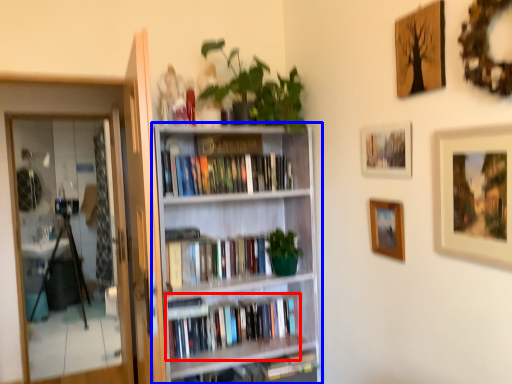
Question: Which object is closer to the camera taking this photo, book (highlighted by a red box) or bookcase (highlighted by a blue box)?

Choices:
 (A) book
 (B) bookcase

Answer: (B)